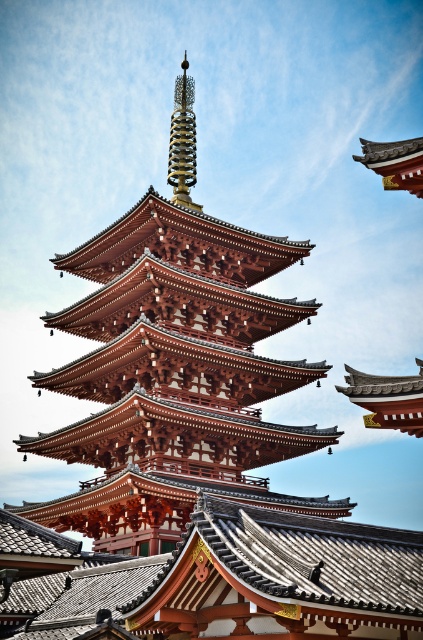
Question: Is matte red pagoda at center positioned before gold spiral spire at center?

Choices:
 (A) no
 (B) yes

Answer: (B)

Question: Among these points, which one is nearest to the camera?

Choices:
 (A) (192, 81)
 (B) (271, 458)

Answer: (B)

Question: Does matte red pagoda at center have a smaller size compared to gold spiral spire at center?

Choices:
 (A) no
 (B) yes

Answer: (A)

Question: Can you confirm if matte red pagoda at center is thinner than gold spiral spire at center?

Choices:
 (A) yes
 (B) no

Answer: (B)

Question: Among these objects, which one is farthest from the camera?

Choices:
 (A) matte red pagoda at center
 (B) gold spiral spire at center

Answer: (B)